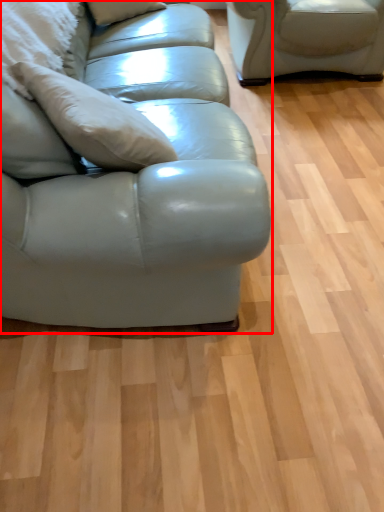
Question: Observing the image, what is the correct spatial positioning of studio couch (annotated by the red box) in reference to pillow?

Choices:
 (A) left
 (B) right

Answer: (B)